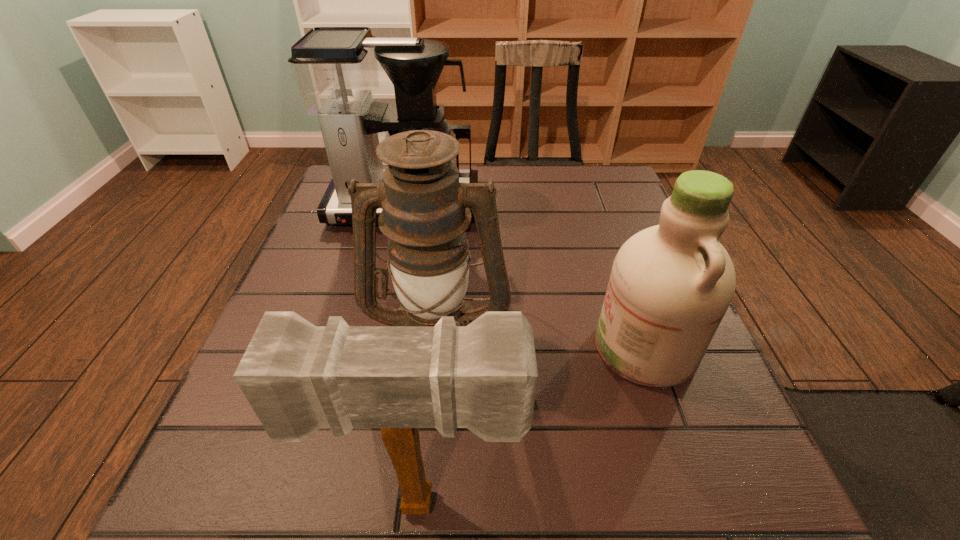
Where is `vacant area that lies between the farthest object and the rightmost object`? vacant area that lies between the farthest object and the rightmost object is located at coordinates (524, 278).

The width and height of the screenshot is (960, 540). Find the location of `vacant region between the mallet and the rightmost object`. vacant region between the mallet and the rightmost object is located at coordinates (534, 426).

The height and width of the screenshot is (540, 960). What are the coordinates of `free space between the oil lamp and the rightmost object` in the screenshot? It's located at (541, 343).

At what (x,y) coordinates should I click in order to perform the action: click on free space between the nearest object and the rightmost object. Please return your answer as a coordinate pair (x, y). Looking at the image, I should click on (534, 426).

Image resolution: width=960 pixels, height=540 pixels. What are the coordinates of `vacant space that's between the nearest object and the rightmost object` in the screenshot? It's located at (534, 426).

This screenshot has width=960, height=540. What are the coordinates of `the third closest object to the nearest object` in the screenshot? It's located at (335, 69).

Find the location of a particular element. object that is the second closest to the mallet is located at coordinates (670, 286).

Locate an element on the screen. This screenshot has width=960, height=540. free region that satisfies the following two spatial constraints: 1. at the front of the oil lamp where the controls are located; 2. on the right side of the coffee maker is located at coordinates (374, 338).

Where is `vacant point that satisfies the following two spatial constraints: 1. at the front of the oil lamp where the controls are located; 2. on the right side of the coffee maker`? Image resolution: width=960 pixels, height=540 pixels. vacant point that satisfies the following two spatial constraints: 1. at the front of the oil lamp where the controls are located; 2. on the right side of the coffee maker is located at coordinates (374, 338).

You are a GUI agent. You are given a task and a screenshot of the screen. Output one action in this format:
    pyautogui.click(x=<x>, y=<y>)
    Task: Click on the vacant space that satisfies the following two spatial constraints: 1. on the front label of the cleansing agent; 2. on the front side of the mallet
    
    Given the screenshot: What is the action you would take?
    pyautogui.click(x=700, y=503)